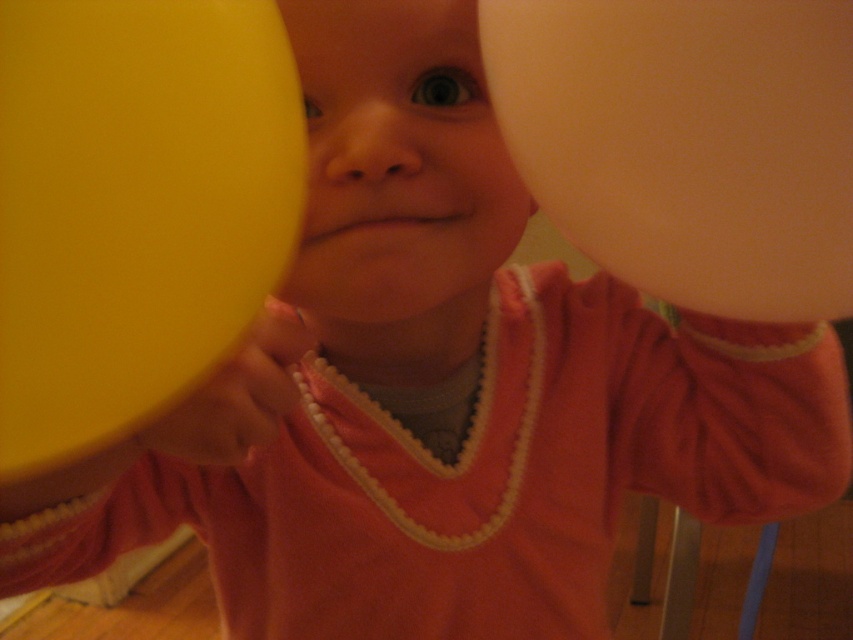
You are a photographer trying to capture a clear shot of the child in the image. The yellow rubber balloon at left is blocking part of the smooth skin face at center. How far apart are these two objects?

The yellow rubber balloon at left and the smooth skin face at center are 4.48 inches apart from each other.

You are a photographer trying to capture a close shot of the child holding the balloons. The point where you need to focus is at point (787, 248). If the camera is 11.60 inches away from this point, will the focus be sharp enough for a clear photo?

The point (787, 248) is 11.60 inches away from the camera, so the focus should be sharp enough for a clear photo as the distance is within a typical camera focus range.

You are a photographer trying to capture the child in the image. Since the matte white balloon at right and the smooth skin face at center are both in the frame, which one should you focus on to ensure the subject is clear?

The smooth skin face at center should be focused on because the matte white balloon at right is smaller in size compared to the smooth skin face at center, making the face the primary subject.